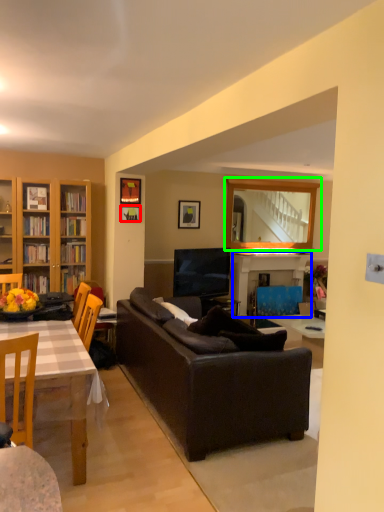
Question: Estimate the real-world distances between objects in this image. Which object is closer to picture frame (highlighted by a red box), fireplace (highlighted by a blue box) or mirror (highlighted by a green box)?

Choices:
 (A) fireplace
 (B) mirror

Answer: (A)